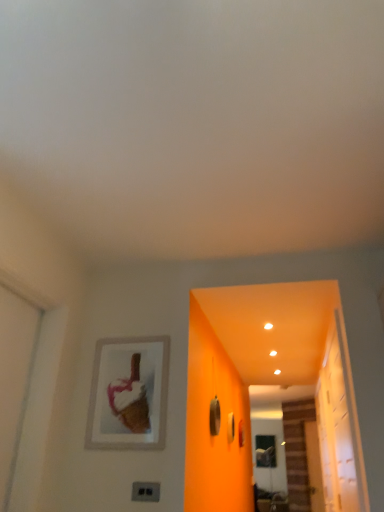
Question: Is transparent glass door at right taller or shorter than transparent glass screen door at lower right?

Choices:
 (A) short
 (B) tall

Answer: (A)

Question: Would you say transparent glass door at right is inside or outside transparent glass screen door at lower right?

Choices:
 (A) outside
 (B) inside

Answer: (A)

Question: Estimate the real-world distances between objects in this image. Which object is closer to the transparent glass door at right?

Choices:
 (A) matte silver picture frame at upper left
 (B) transparent glass screen door at lower right
 (C) black plastic electric outlet at lower center

Answer: (A)

Question: Which object is the farthest from the transparent glass screen door at lower right?

Choices:
 (A) transparent glass door at right
 (B) matte silver picture frame at upper left
 (C) black plastic electric outlet at lower center

Answer: (C)